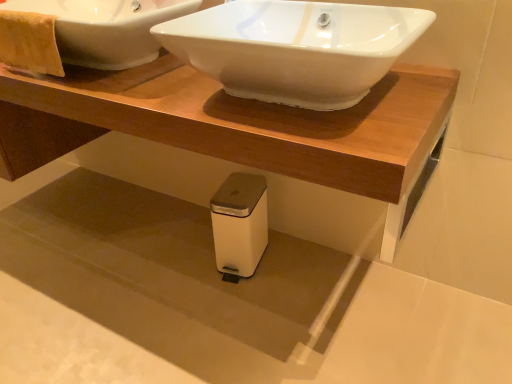
Question: From the image's perspective, relative to yellow textured towel at upper left, is white glossy sink at upper center, placed as the second sink when sorted from left to right, above or below?

Choices:
 (A) above
 (B) below

Answer: (B)

Question: Would you say white glossy sink at upper center, marked as the 1th sink in a right-to-left arrangement, is to the left or to the right of yellow textured towel at upper left in the picture?

Choices:
 (A) right
 (B) left

Answer: (A)

Question: Which object is the farthest from the yellow textured towel at upper left?

Choices:
 (A) white matte trash can at lower center
 (B) white plastic trash can at lower center
 (C) white glossy sink at upper center, which is the 2th sink from right to left
 (D) white glossy sink at upper center, placed as the second sink when sorted from left to right

Answer: (A)

Question: Which object is the closest to the white glossy sink at upper center, acting as the 1th sink starting from the left?

Choices:
 (A) white glossy sink at upper center, placed as the second sink when sorted from left to right
 (B) white matte trash can at lower center
 (C) white plastic trash can at lower center
 (D) yellow textured towel at upper left

Answer: (D)